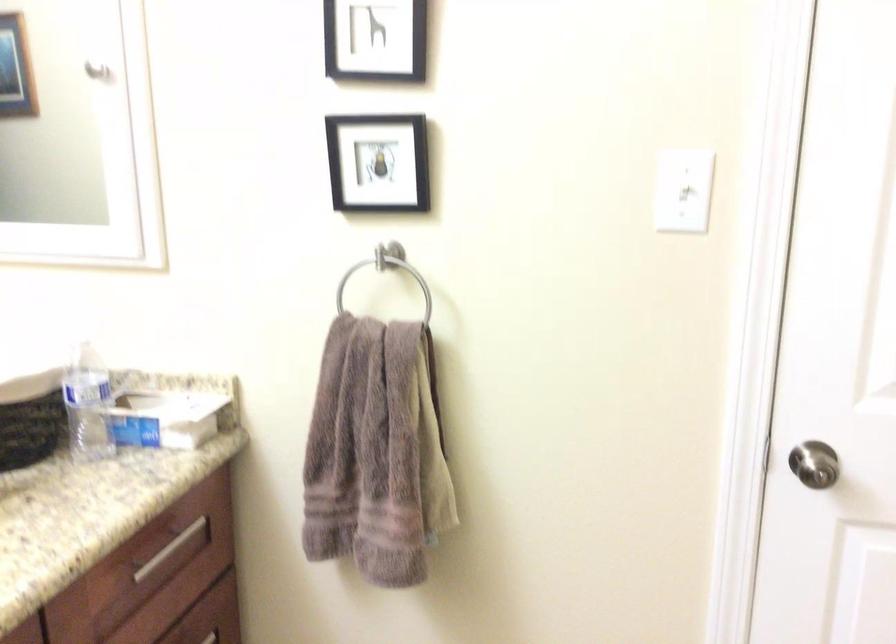
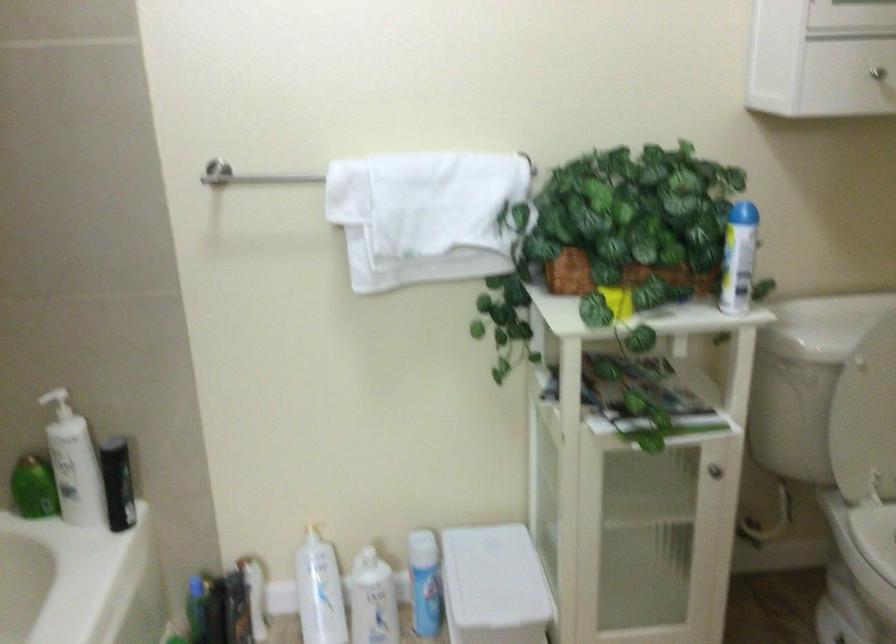
First-person continuous shooting, in which direction is the camera rotating?

The camera's rotation is toward right-down.